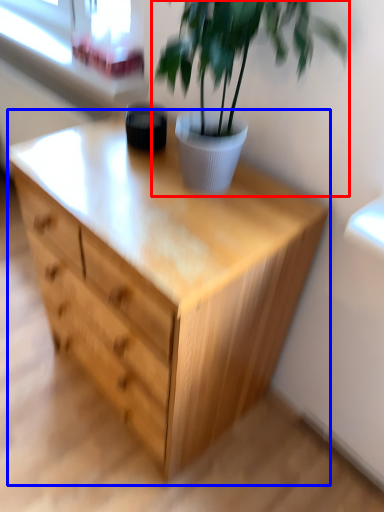
Question: Which point is further to the camera, houseplant (highlighted by a red box) or chest of drawers (highlighted by a blue box)?

Choices:
 (A) houseplant
 (B) chest of drawers

Answer: (B)